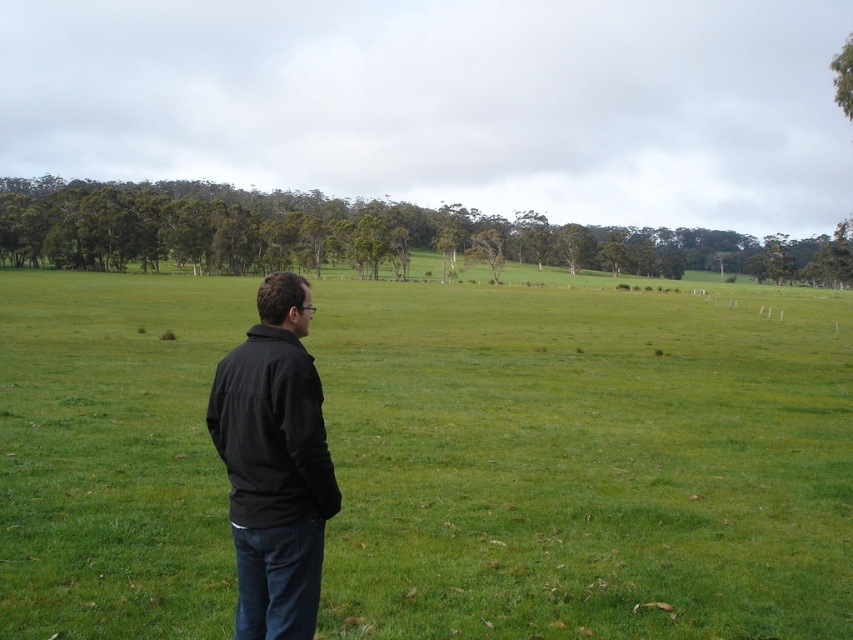
Question: Among these points, which one is farthest from the camera?

Choices:
 (A) (287, 632)
 (B) (654, 257)
 (C) (99, 381)
 (D) (840, 74)

Answer: (B)

Question: Which point appears closest to the camera in this image?

Choices:
 (A) (312, 577)
 (B) (448, 486)

Answer: (A)

Question: Which object is positioned farthest from the black matte jacket at left?

Choices:
 (A) green grass pasture at center
 (B) green leafy trees at center
 (C) green leafy tree at upper right

Answer: (B)

Question: Does green grass pasture at center appear on the left side of green leafy tree at upper right?

Choices:
 (A) no
 (B) yes

Answer: (B)

Question: Is green leafy trees at center behind green leafy tree at upper right?

Choices:
 (A) yes
 (B) no

Answer: (A)

Question: Does green grass pasture at center appear on the right side of green leafy tree at upper right?

Choices:
 (A) yes
 (B) no

Answer: (B)